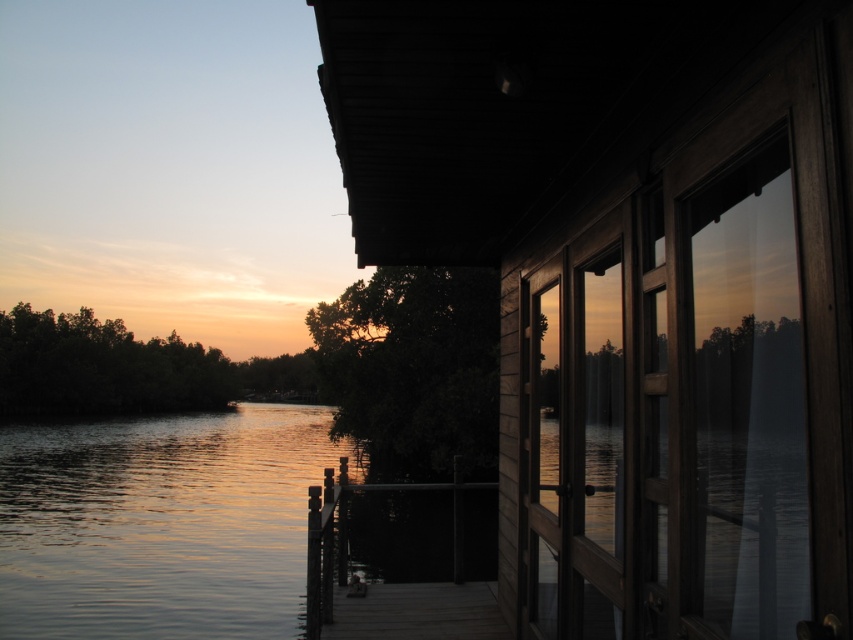
You are standing on the wooden dock at center and want to reach the wooden cabin at right. The path between them is straight. If your wheelchair has a minimum turning radius of 8 feet, can you navigate directly to the cabin without needing to turn?

The wooden cabin at right and wooden dock at center are 8.35 feet apart from each other. Since the minimum turning radius required is 8 feet and the distance between them is just over that, you can navigate directly to the cabin without needing to turn as the distance allows for the required turning space.

You are standing on the wooden dock at center and want to walk towards the glistening water at lower left. Which direction should you face to move towards it?

You should face left because the glistening water at lower left is positioned on the left side of the wooden dock at center.